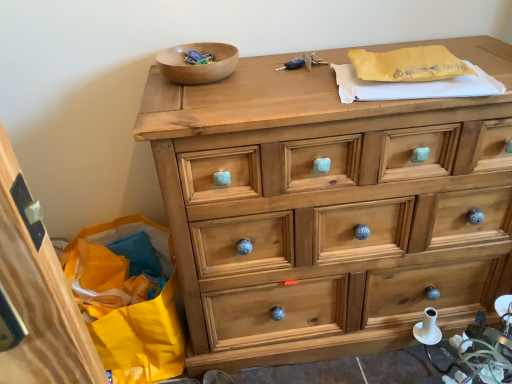
Question: From the image's perspective, does light brown wood chest of drawers at center appear higher than wooden bowl at upper center?

Choices:
 (A) yes
 (B) no

Answer: (B)

Question: Is the position of light brown wood chest of drawers at center less distant than that of wooden bowl at upper center?

Choices:
 (A) no
 (B) yes

Answer: (B)

Question: Does light brown wood chest of drawers at center appear on the right side of wooden bowl at upper center?

Choices:
 (A) yes
 (B) no

Answer: (A)

Question: Can you confirm if light brown wood chest of drawers at center is wider than wooden bowl at upper center?

Choices:
 (A) yes
 (B) no

Answer: (A)

Question: Does light brown wood chest of drawers at center come behind wooden bowl at upper center?

Choices:
 (A) yes
 (B) no

Answer: (B)

Question: From the image's perspective, is light brown wood chest of drawers at center beneath wooden bowl at upper center?

Choices:
 (A) yes
 (B) no

Answer: (A)

Question: Is wooden bowl at upper center positioned in front of light brown wood chest of drawers at center?

Choices:
 (A) no
 (B) yes

Answer: (A)

Question: Is wooden bowl at upper center further to the viewer compared to light brown wood chest of drawers at center?

Choices:
 (A) no
 (B) yes

Answer: (B)

Question: Can you confirm if wooden bowl at upper center is thinner than light brown wood chest of drawers at center?

Choices:
 (A) no
 (B) yes

Answer: (B)

Question: Considering the relative positions of wooden bowl at upper center and light brown wood chest of drawers at center in the image provided, is wooden bowl at upper center to the left of light brown wood chest of drawers at center from the viewer's perspective?

Choices:
 (A) yes
 (B) no

Answer: (A)

Question: From a real-world perspective, is wooden bowl at upper center physically above light brown wood chest of drawers at center?

Choices:
 (A) yes
 (B) no

Answer: (A)

Question: Considering the relative sizes of wooden bowl at upper center and light brown wood chest of drawers at center in the image provided, is wooden bowl at upper center shorter than light brown wood chest of drawers at center?

Choices:
 (A) no
 (B) yes

Answer: (B)

Question: From the image's perspective, is light brown wood chest of drawers at center above or below wooden bowl at upper center?

Choices:
 (A) above
 (B) below

Answer: (B)